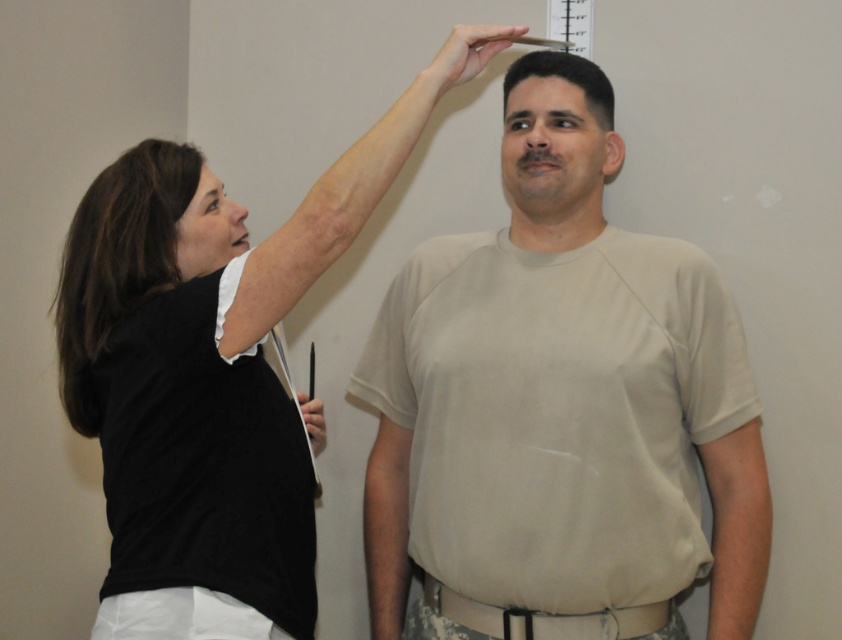
Question: Which point is closer to the camera?

Choices:
 (A) black matte shirt at upper left
 (B) beige cotton shirt at center

Answer: (A)

Question: Among these points, which one is farthest from the camera?

Choices:
 (A) (445, 589)
 (B) (662, 605)

Answer: (A)

Question: Is black matte shirt at upper left in front of black fabric belt at center?

Choices:
 (A) no
 (B) yes

Answer: (B)

Question: Considering the real-world distances, which object is farthest from the black matte shirt at upper left?

Choices:
 (A) beige cotton shirt at center
 (B) black fabric belt at center

Answer: (B)

Question: Can you confirm if beige cotton shirt at center is positioned to the left of black fabric belt at center?

Choices:
 (A) yes
 (B) no

Answer: (B)

Question: Can you confirm if beige cotton shirt at center is positioned below black fabric belt at center?

Choices:
 (A) yes
 (B) no

Answer: (B)